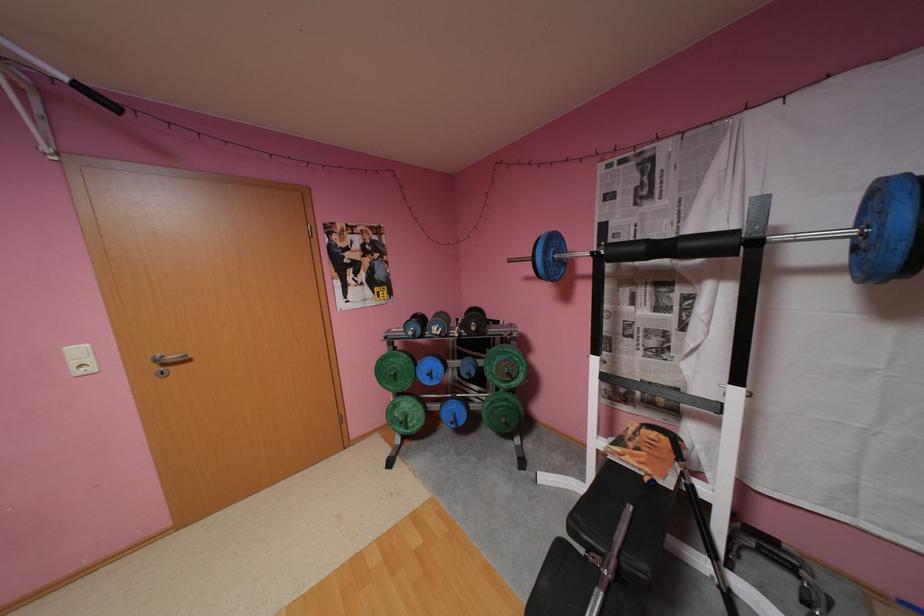
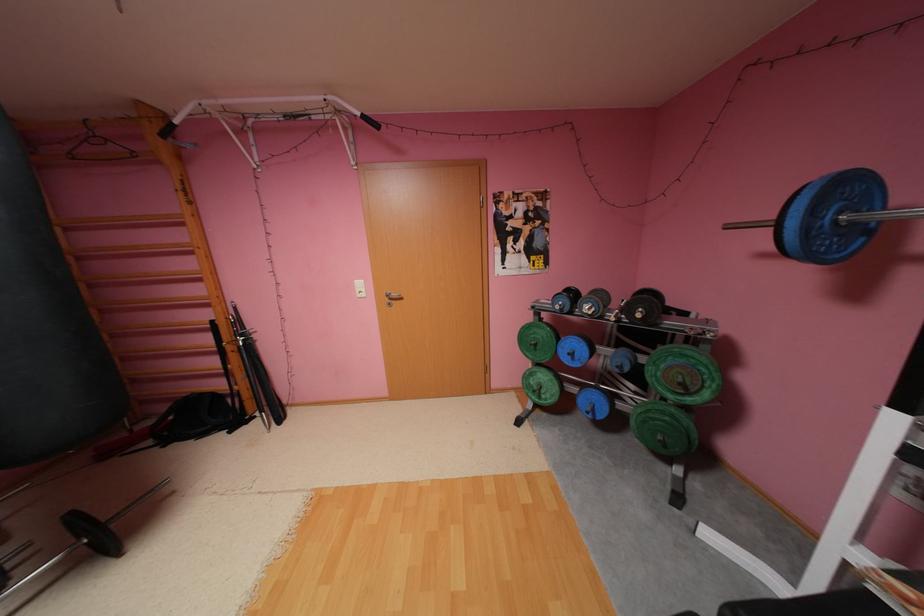
Find the pixel in the second image that matches the point at 447,334 in the first image.

(600, 315)